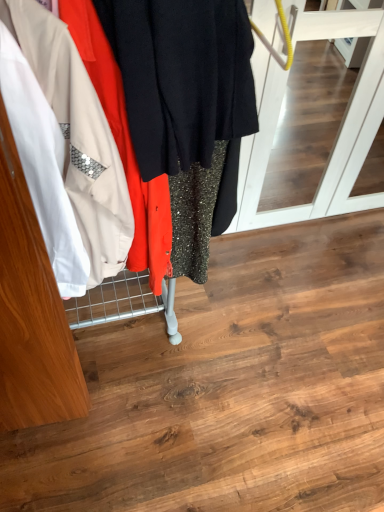
Question: Is matte black screen door at center in front of or behind metallic sequined dress at left in the image?

Choices:
 (A) behind
 (B) front

Answer: (A)

Question: From the image's perspective, is matte black screen door at center located above or below metallic sequined dress at left?

Choices:
 (A) above
 (B) below

Answer: (A)

Question: From a real-world perspective, is matte black screen door at center positioned above or below metallic sequined dress at left?

Choices:
 (A) below
 (B) above

Answer: (A)

Question: From a real-world perspective, relative to matte black screen door at center, is metallic sequined dress at left vertically above or below?

Choices:
 (A) above
 (B) below

Answer: (A)

Question: Relative to matte black screen door at center, is metallic sequined dress at left in front or behind?

Choices:
 (A) front
 (B) behind

Answer: (A)

Question: From the image's perspective, is metallic sequined dress at left located above or below matte black screen door at center?

Choices:
 (A) above
 (B) below

Answer: (B)

Question: Considering the positions of metallic sequined dress at left and matte black screen door at center in the image, is metallic sequined dress at left bigger or smaller than matte black screen door at center?

Choices:
 (A) small
 (B) big

Answer: (A)